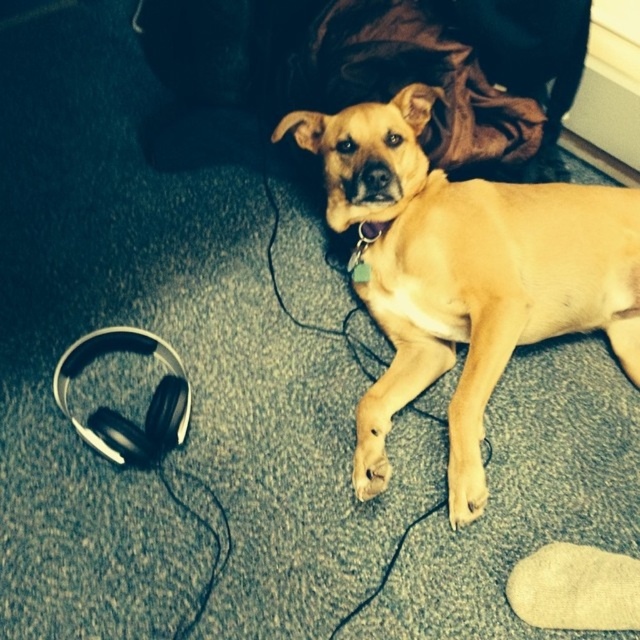
Question: Is black matte headphones at lower left wider than light brown fur at lower center?

Choices:
 (A) yes
 (B) no

Answer: (A)

Question: Which point is farther to the camera?

Choices:
 (A) (483, 481)
 (B) (170, 412)
 (C) (365, 404)
 (D) (403, 253)

Answer: (D)

Question: Which point is farther from the camera taking this photo?

Choices:
 (A) (358, 442)
 (B) (468, 500)

Answer: (A)

Question: Considering the real-world distances, which object is closest to the black matte headphones at lower left?

Choices:
 (A) light brown fur at lower center
 (B) golden matte dog at center
 (C) light brown fur paw at lower center

Answer: (C)

Question: Does black matte headphones at lower left have a smaller size compared to light brown fur paw at lower center?

Choices:
 (A) no
 (B) yes

Answer: (A)

Question: Can you confirm if golden matte dog at center is positioned below light brown fur at lower center?

Choices:
 (A) no
 (B) yes

Answer: (A)